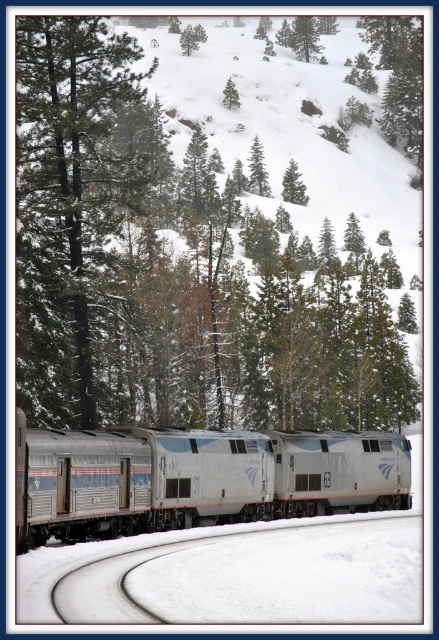
Question: Can you confirm if smooth dark green tree at left is positioned below silver metallic train at center?

Choices:
 (A) no
 (B) yes

Answer: (A)

Question: Based on their relative distances, which object is farther from the green matte tree at upper center?

Choices:
 (A) smooth dark green tree at left
 (B) silver metallic train at center

Answer: (B)

Question: Does green matte tree at center appear on the left side of smooth dark green tree at left?

Choices:
 (A) no
 (B) yes

Answer: (A)

Question: Does silver metallic train at center appear over green matte tree at upper center?

Choices:
 (A) no
 (B) yes

Answer: (A)

Question: Which object appears farthest from the camera in this image?

Choices:
 (A) silver metallic train at center
 (B) green matte tree at upper center
 (C) green matte tree at center
 (D) smooth dark green tree at left

Answer: (B)

Question: Which of the following is the closest to the observer?

Choices:
 (A) silver metallic train at center
 (B) green matte tree at center
 (C) green matte tree at upper center

Answer: (A)